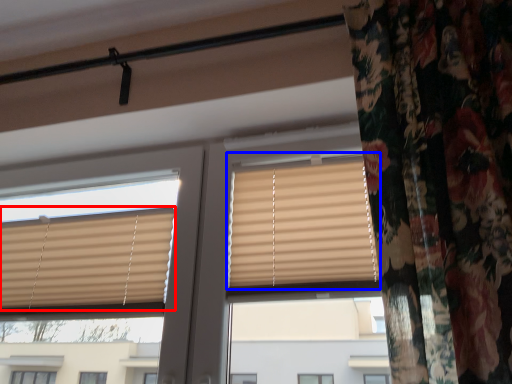
Question: Which object appears closest to the camera in this image, window blind (highlighted by a red box) or window (highlighted by a blue box)?

Choices:
 (A) window blind
 (B) window

Answer: (B)